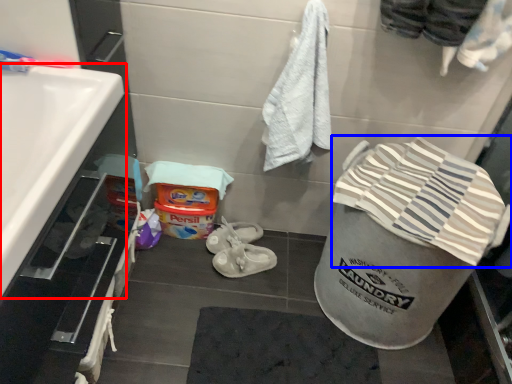
Question: Which of the following is the closest to the observer, sink (highlighted by a red box) or beach towel (highlighted by a blue box)?

Choices:
 (A) sink
 (B) beach towel

Answer: (A)